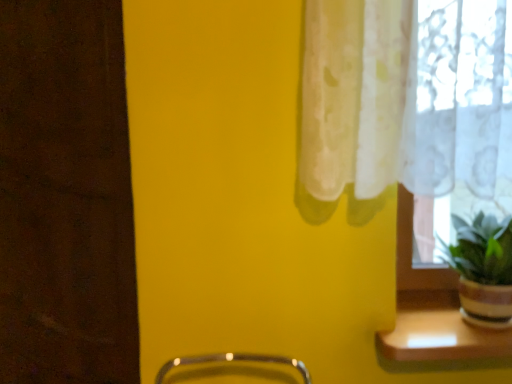
Identify the location of free space to the left of green matte plant at right. (413, 326).